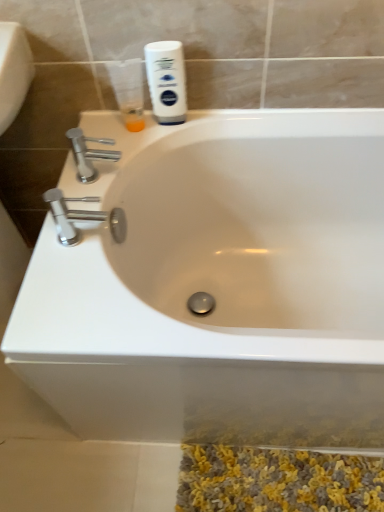
What are the coordinates of `white glossy bathtub at center` in the screenshot? It's located at (219, 285).

How much space does chrome metallic faucet at left, the second tap when ordered from top to bottom, occupy vertically?

chrome metallic faucet at left, the second tap when ordered from top to bottom, is 5.03 inches tall.

Describe the element at coordinates (70, 215) in the screenshot. The image size is (384, 512). I see `chrome metallic faucet at left, marked as the first tap in a bottom-to-top arrangement` at that location.

Describe the element at coordinates (89, 153) in the screenshot. I see `polished chrome faucet at upper left, the 2th tap viewed from the front` at that location.

Where is `white matte shaving cream at upper center`? white matte shaving cream at upper center is located at coordinates (166, 81).

Is white matte shaving cream at upper center wider or thinner than white glossy bathtub at center?

Clearly, white matte shaving cream at upper center has less width compared to white glossy bathtub at center.

Between white matte shaving cream at upper center and white glossy bathtub at center, which one is positioned behind?

Positioned behind is white matte shaving cream at upper center.

Considering the sizes of white matte shaving cream at upper center and white glossy bathtub at center in the image, is white matte shaving cream at upper center bigger or smaller than white glossy bathtub at center?

Clearly, white matte shaving cream at upper center is smaller in size than white glossy bathtub at center.

Locate an element on the screen. This screenshot has width=384, height=512. mouthwash above the white glossy bathtub at center (from a real-world perspective) is located at coordinates (128, 91).

Is translucent plastic cup at upper left aimed at white glossy bathtub at center?

No, translucent plastic cup at upper left is not aimed at white glossy bathtub at center.

Can you tell me how much translucent plastic cup at upper left and white glossy bathtub at center differ in facing direction?

0.52 degrees.

Does translucent plastic cup at upper left appear on the left side of white glossy bathtub at center?

Yes, translucent plastic cup at upper left is to the left of white glossy bathtub at center.

Consider the image. Is the surface of polished chrome faucet at upper left, the 2th tap viewed from the front, in direct contact with chrome metallic faucet at left, the second tap when ordered from top to bottom?

No, polished chrome faucet at upper left, the 2th tap viewed from the front, is not making contact with chrome metallic faucet at left, the second tap when ordered from top to bottom.

Considering the sizes of objects polished chrome faucet at upper left, the 2th tap viewed from the front, and chrome metallic faucet at left, the 2th tap from the back, in the image provided, who is smaller, polished chrome faucet at upper left, the 2th tap viewed from the front, or chrome metallic faucet at left, the 2th tap from the back,?

Smaller between the two is polished chrome faucet at upper left, the 2th tap viewed from the front.

From the image's perspective, does polished chrome faucet at upper left, which appears as the first tap when viewed from the top, appear lower than chrome metallic faucet at left, the second tap when ordered from top to bottom?

Actually, polished chrome faucet at upper left, which appears as the first tap when viewed from the top, appears above chrome metallic faucet at left, the second tap when ordered from top to bottom, in the image.

From the picture: Is polished chrome faucet at upper left, marked as the first tap in a back-to-front arrangement, further to camera compared to chrome metallic faucet at left, the second tap when ordered from top to bottom?

Yes, it is.

From a real-world perspective, is white matte shaving cream at upper center beneath chrome metallic faucet at left, marked as the first tap in a bottom-to-top arrangement?

Actually, white matte shaving cream at upper center is physically above chrome metallic faucet at left, marked as the first tap in a bottom-to-top arrangement, in the real world.

Would you consider white matte shaving cream at upper center to be distant from chrome metallic faucet at left, acting as the first tap starting from the front?

No, white matte shaving cream at upper center is not far away from chrome metallic faucet at left, acting as the first tap starting from the front.

Does white matte shaving cream at upper center turn towards chrome metallic faucet at left, the 2th tap from the back?

No, white matte shaving cream at upper center does not turn towards chrome metallic faucet at left, the 2th tap from the back.

Between white matte shaving cream at upper center and chrome metallic faucet at left, marked as the first tap in a bottom-to-top arrangement, which one appears on the left side from the viewer's perspective?

chrome metallic faucet at left, marked as the first tap in a bottom-to-top arrangement.

From a real-world perspective, relative to translucent plastic cup at upper left, is white glossy bathtub at center vertically above or below?

white glossy bathtub at center is below translucent plastic cup at upper left.

Considering the relative sizes of white glossy bathtub at center and translucent plastic cup at upper left in the image provided, is white glossy bathtub at center shorter than translucent plastic cup at upper left?

No, white glossy bathtub at center is not shorter than translucent plastic cup at upper left.

Would you consider white glossy bathtub at center to be distant from translucent plastic cup at upper left?

They are positioned close to each other.

Is translucent plastic cup at upper left with polished chrome faucet at upper left, the 2th tap viewed from the front?

No, translucent plastic cup at upper left is not making contact with polished chrome faucet at upper left, the 2th tap viewed from the front.

From a real-world perspective, is translucent plastic cup at upper left physically located above or below polished chrome faucet at upper left, which appears as the first tap when viewed from the top?

→ translucent plastic cup at upper left is situated higher than polished chrome faucet at upper left, which appears as the first tap when viewed from the top, in the real world.

Could you measure the distance between translucent plastic cup at upper left and polished chrome faucet at upper left, marked as the first tap in a back-to-front arrangement?

translucent plastic cup at upper left and polished chrome faucet at upper left, marked as the first tap in a back-to-front arrangement, are 4.99 inches apart from each other.

Based on their positions, is translucent plastic cup at upper left located to the left or right of polished chrome faucet at upper left, the 2th tap viewed from the front?

From the image, it's evident that translucent plastic cup at upper left is to the right of polished chrome faucet at upper left, the 2th tap viewed from the front.

Consider the image. Between chrome metallic faucet at left, marked as the first tap in a bottom-to-top arrangement, and white glossy bathtub at center, which one has more height?

Standing taller between the two is white glossy bathtub at center.

From the image's perspective, between chrome metallic faucet at left, the 2th tap from the back, and white glossy bathtub at center, who is located below?

white glossy bathtub at center is shown below in the image.

Image resolution: width=384 pixels, height=512 pixels. What are the coordinates of `shaving cream that is behind the white glossy bathtub at center` in the screenshot? It's located at (166, 81).

The height and width of the screenshot is (512, 384). I want to click on bathtub located on the right of translucent plastic cup at upper left, so click(x=219, y=285).

Which object lies nearer to the anchor point chrome metallic faucet at left, the second tap when ordered from top to bottom, white glossy bathtub at center or white matte shaving cream at upper center?

white matte shaving cream at upper center.

Estimate the real-world distances between objects in this image. Which object is further from polished chrome faucet at upper left, marked as the first tap in a back-to-front arrangement, white glossy bathtub at center or chrome metallic faucet at left, the second tap when ordered from top to bottom?

The object further to polished chrome faucet at upper left, marked as the first tap in a back-to-front arrangement, is white glossy bathtub at center.

Considering their positions, is chrome metallic faucet at left, acting as the first tap starting from the front, positioned closer to white matte shaving cream at upper center than translucent plastic cup at upper left?

translucent plastic cup at upper left.

Based on their spatial positions, is chrome metallic faucet at left, the second tap when ordered from top to bottom, or white matte shaving cream at upper center further from translucent plastic cup at upper left?

chrome metallic faucet at left, the second tap when ordered from top to bottom, is further to translucent plastic cup at upper left.

Considering their positions, is translucent plastic cup at upper left positioned further to polished chrome faucet at upper left, marked as the first tap in a back-to-front arrangement, than white matte shaving cream at upper center?

white matte shaving cream at upper center is further to polished chrome faucet at upper left, marked as the first tap in a back-to-front arrangement.

Estimate the real-world distances between objects in this image. Which object is closer to white matte shaving cream at upper center, polished chrome faucet at upper left, the 2th tap viewed from the front, or chrome metallic faucet at left, the 2th tap from the back?

Based on the image, polished chrome faucet at upper left, the 2th tap viewed from the front, appears to be nearer to white matte shaving cream at upper center.

When comparing their distances from translucent plastic cup at upper left, does polished chrome faucet at upper left, marked as the first tap in a back-to-front arrangement, or white matte shaving cream at upper center seem closer?

white matte shaving cream at upper center is positioned closer to the anchor translucent plastic cup at upper left.

Looking at the image, which one is located closer to white glossy bathtub at center, chrome metallic faucet at left, the second tap when ordered from top to bottom, or polished chrome faucet at upper left, the second tap when ordered from bottom to top?

chrome metallic faucet at left, the second tap when ordered from top to bottom, is positioned closer to the anchor white glossy bathtub at center.

The height and width of the screenshot is (512, 384). Identify the location of mouthwash that lies between white matte shaving cream at upper center and polished chrome faucet at upper left, which appears as the first tap when viewed from the top, from top to bottom. (128, 91).

Locate an element on the screen. This screenshot has height=512, width=384. mouthwash between white matte shaving cream at upper center and white glossy bathtub at center in the up-down direction is located at coordinates (128, 91).

The height and width of the screenshot is (512, 384). I want to click on tap between translucent plastic cup at upper left and chrome metallic faucet at left, the 2th tap from the back, from top to bottom, so click(89, 153).

I want to click on tap between polished chrome faucet at upper left, marked as the first tap in a back-to-front arrangement, and white glossy bathtub at center from left to right, so click(x=70, y=215).